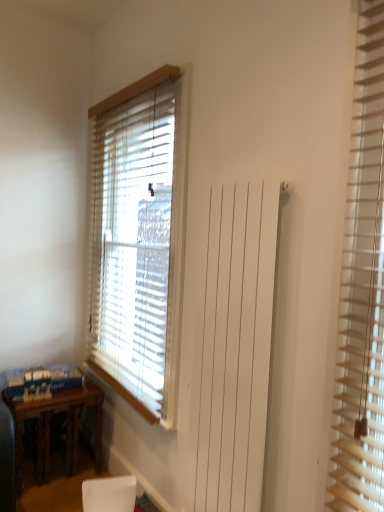
Based on the photo, how much space does wooden blinds at center, which appears as the second window blind when viewed from the right, occupy horizontally?

wooden blinds at center, which appears as the second window blind when viewed from the right, is 14.92 centimeters in width.

What do you see at coordinates (362, 290) in the screenshot?
I see `wooden blinds at right, marked as the 2th window blind in a left-to-right arrangement` at bounding box center [362, 290].

This screenshot has height=512, width=384. Describe the element at coordinates (66, 428) in the screenshot. I see `brown wooden table at lower left` at that location.

The height and width of the screenshot is (512, 384). What are the coordinates of `wooden blinds at center, the first window blind viewed from the back` in the screenshot? It's located at (138, 240).

Can you confirm if brown wooden table at lower left is smaller than white matte armchair at lower center?

Actually, brown wooden table at lower left might be larger than white matte armchair at lower center.

You are a GUI agent. You are given a task and a screenshot of the screen. Output one action in this format:
    pyautogui.click(x=<x>, y=<y>)
    Task: Click on the armchair below the brown wooden table at lower left (from the image's perspective)
    
    Given the screenshot: What is the action you would take?
    pyautogui.click(x=109, y=494)

Is brown wooden table at lower left beside white matte armchair at lower center?

No, brown wooden table at lower left is not with white matte armchair at lower center.

Is point (21, 423) in front of point (176, 219)?

No, (21, 423) is further to viewer.

From the image's perspective, which is above, brown wooden table at lower left or wooden blinds at center, which is counted as the 1th window blind, starting from the left?

From the image's view, wooden blinds at center, which is counted as the 1th window blind, starting from the left, is above.

Considering the sizes of brown wooden table at lower left and wooden blinds at center, the first window blind viewed from the back, in the image, is brown wooden table at lower left wider or thinner than wooden blinds at center, the first window blind viewed from the back,?

In the image, brown wooden table at lower left appears to be wider than wooden blinds at center, the first window blind viewed from the back.

How different are the orientations of brown wooden table at lower left and wooden blinds at center, which is counted as the 1th window blind, starting from the left, in degrees?

90 degrees separate the facing orientations of brown wooden table at lower left and wooden blinds at center, which is counted as the 1th window blind, starting from the left.

Considering the relative positions of white matte armchair at lower center and brown wooden table at lower left in the image provided, is white matte armchair at lower center in front of brown wooden table at lower left?

Yes.

Is white matte armchair at lower center next to brown wooden table at lower left and touching it?

No, white matte armchair at lower center is not making contact with brown wooden table at lower left.

Looking at this image, which of these two, white matte armchair at lower center or brown wooden table at lower left, is wider?

brown wooden table at lower left is wider.

From a real-world perspective, is white matte armchair at lower center physically located above or below brown wooden table at lower left?

white matte armchair at lower center is situated lower than brown wooden table at lower left in the real world.

Considering the relative positions of white matte armchair at lower center and wooden blinds at right, the 2th window blind in the back-to-front sequence, in the image provided, is white matte armchair at lower center to the right of wooden blinds at right, the 2th window blind in the back-to-front sequence, from the viewer's perspective?

No.

Is wooden blinds at right, which is the first window blind in right-to-left order, completely or partially inside white matte armchair at lower center?

No, wooden blinds at right, which is the first window blind in right-to-left order, is not surrounded by white matte armchair at lower center.

Is white matte armchair at lower center taller or shorter than wooden blinds at right, the 1th window blind when ordered from front to back?

In the image, white matte armchair at lower center appears to be shorter than wooden blinds at right, the 1th window blind when ordered from front to back.

Consider the image. Is wooden blinds at right, marked as the 2th window blind in a left-to-right arrangement, bigger or smaller than brown wooden table at lower left?

Considering their sizes, wooden blinds at right, marked as the 2th window blind in a left-to-right arrangement, takes up less space than brown wooden table at lower left.

What's the angular difference between wooden blinds at right, marked as the 2th window blind in a left-to-right arrangement, and brown wooden table at lower left's facing directions?

wooden blinds at right, marked as the 2th window blind in a left-to-right arrangement, and brown wooden table at lower left are facing 90 degrees away from each other.

Is wooden blinds at right, marked as the 2th window blind in a left-to-right arrangement, facing towards brown wooden table at lower left?

No, wooden blinds at right, marked as the 2th window blind in a left-to-right arrangement, is not facing towards brown wooden table at lower left.

Is point (73, 435) behind point (376, 207)?

Yes, it is.

Is brown wooden table at lower left turned away from wooden blinds at right, the 2th window blind in the back-to-front sequence?

That's not correct — brown wooden table at lower left is not looking away from wooden blinds at right, the 2th window blind in the back-to-front sequence.

Considering the sizes of objects brown wooden table at lower left and wooden blinds at right, the 1th window blind when ordered from front to back, in the image provided, who is smaller, brown wooden table at lower left or wooden blinds at right, the 1th window blind when ordered from front to back,?

wooden blinds at right, the 1th window blind when ordered from front to back.

How far apart are wooden blinds at center, which is counted as the 2th window blind, starting from the front, and brown wooden table at lower left?

wooden blinds at center, which is counted as the 2th window blind, starting from the front, is 30.68 inches from brown wooden table at lower left.

Locate an element on the screen. This screenshot has width=384, height=512. the 1st window blind in front of the brown wooden table at lower left is located at coordinates (138, 240).

In the scene shown: Relative to brown wooden table at lower left, is wooden blinds at center, which is counted as the 1th window blind, starting from the left, in front or behind?

wooden blinds at center, which is counted as the 1th window blind, starting from the left, is in front of brown wooden table at lower left.

Considering the relative positions of wooden blinds at center, which appears as the second window blind when viewed from the right, and brown wooden table at lower left in the image provided, is wooden blinds at center, which appears as the second window blind when viewed from the right, to the right of brown wooden table at lower left from the viewer's perspective?

Yes.

The width and height of the screenshot is (384, 512). In order to click on armchair located on the right of brown wooden table at lower left in this screenshot , I will do `click(109, 494)`.

From a real-world perspective, count 2nd window blinds upward from the brown wooden table at lower left and point to it. Please provide its 2D coordinates.

[(138, 240)]

From the picture: Based on their spatial positions, is wooden blinds at center, which appears as the second window blind when viewed from the right, or white matte armchair at lower center further from wooden blinds at right, the 1th window blind when ordered from front to back?

wooden blinds at center, which appears as the second window blind when viewed from the right, is positioned further to the anchor wooden blinds at right, the 1th window blind when ordered from front to back.

Looking at the image, which one is located further to wooden blinds at right, the 1th window blind when ordered from front to back, wooden blinds at center, which is counted as the 1th window blind, starting from the left, or brown wooden table at lower left?

brown wooden table at lower left is further to wooden blinds at right, the 1th window blind when ordered from front to back.

Considering their positions, is wooden blinds at center, which is counted as the 2th window blind, starting from the front, positioned closer to brown wooden table at lower left than wooden blinds at right, marked as the 2th window blind in a left-to-right arrangement?

Based on the image, wooden blinds at center, which is counted as the 2th window blind, starting from the front, appears to be nearer to brown wooden table at lower left.

Which object lies further to the anchor point brown wooden table at lower left, white matte armchair at lower center or wooden blinds at center, which is counted as the 2th window blind, starting from the front?

wooden blinds at center, which is counted as the 2th window blind, starting from the front, is positioned further to the anchor brown wooden table at lower left.

Estimate the real-world distances between objects in this image. Which object is further from white matte armchair at lower center, brown wooden table at lower left or wooden blinds at right, marked as the 2th window blind in a left-to-right arrangement?

wooden blinds at right, marked as the 2th window blind in a left-to-right arrangement, is positioned further to the anchor white matte armchair at lower center.

Considering their positions, is brown wooden table at lower left positioned closer to wooden blinds at right, which is the first window blind in right-to-left order, than wooden blinds at center, which is counted as the 1th window blind, starting from the left?

Based on the image, wooden blinds at center, which is counted as the 1th window blind, starting from the left, appears to be nearer to wooden blinds at right, which is the first window blind in right-to-left order.

Considering their positions, is white matte armchair at lower center positioned closer to wooden blinds at right, marked as the 2th window blind in a left-to-right arrangement, than brown wooden table at lower left?

Based on the image, white matte armchair at lower center appears to be nearer to wooden blinds at right, marked as the 2th window blind in a left-to-right arrangement.

Looking at the image, which one is located closer to brown wooden table at lower left, wooden blinds at center, which is counted as the 1th window blind, starting from the left, or white matte armchair at lower center?

white matte armchair at lower center is closer to brown wooden table at lower left.

Identify the location of window blind between wooden blinds at center, which is counted as the 1th window blind, starting from the left, and white matte armchair at lower center, in the vertical direction. (362, 290).

Where is `table between wooden blinds at center, which appears as the second window blind when viewed from the right, and white matte armchair at lower center, in the vertical direction`? Image resolution: width=384 pixels, height=512 pixels. table between wooden blinds at center, which appears as the second window blind when viewed from the right, and white matte armchair at lower center, in the vertical direction is located at coordinates (66, 428).

You are a GUI agent. You are given a task and a screenshot of the screen. Output one action in this format:
    pyautogui.click(x=<x>, y=<y>)
    Task: Click on the armchair located between brown wooden table at lower left and wooden blinds at right, marked as the 2th window blind in a left-to-right arrangement, in the left-right direction
    Image resolution: width=384 pixels, height=512 pixels.
    Given the screenshot: What is the action you would take?
    pyautogui.click(x=109, y=494)

Locate an element on the screen. This screenshot has width=384, height=512. window blind between brown wooden table at lower left and wooden blinds at right, the 1th window blind when ordered from front to back, in the horizontal direction is located at coordinates (138, 240).